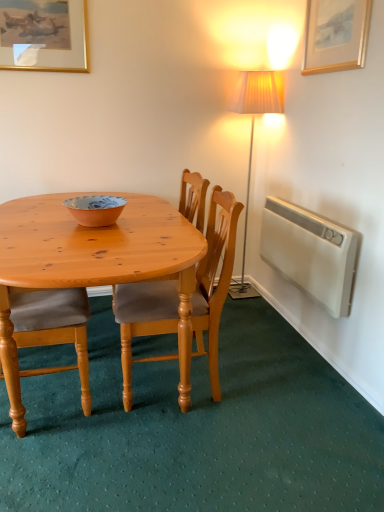
At what (x,y) coordinates should I click in order to perform the action: click on vacant space underneath light brown wood chair at center, the first chair in the right-to-left sequence (from a real-world perspective). Please return your answer as a coordinate pair (x, y). Looking at the image, I should click on (173, 386).